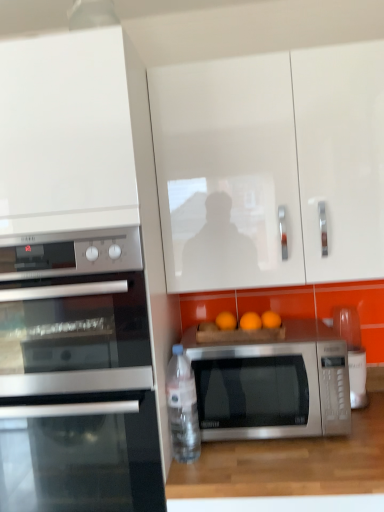
Where is `free space in front of satin silver microwave at center, placed as the first microwave oven when sorted from right to left`? This screenshot has height=512, width=384. free space in front of satin silver microwave at center, placed as the first microwave oven when sorted from right to left is located at coordinates (274, 459).